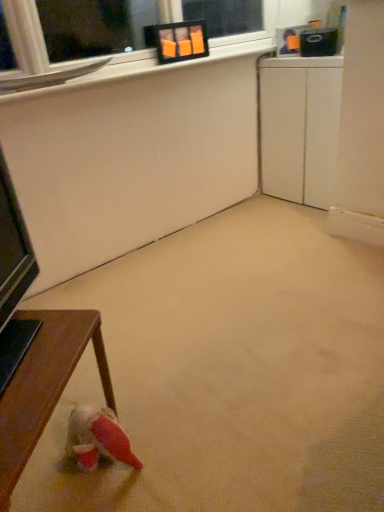
Question: Considering the relative sizes of wooden table at lower left and beige carpet at center in the image provided, is wooden table at lower left bigger than beige carpet at center?

Choices:
 (A) no
 (B) yes

Answer: (A)

Question: From a real-world perspective, does wooden table at lower left sit lower than beige carpet at center?

Choices:
 (A) yes
 (B) no

Answer: (B)

Question: Is wooden table at lower left not near beige carpet at center?

Choices:
 (A) no
 (B) yes

Answer: (A)

Question: Is beige carpet at center inside wooden table at lower left?

Choices:
 (A) no
 (B) yes

Answer: (A)

Question: Is wooden table at lower left thinner than beige carpet at center?

Choices:
 (A) yes
 (B) no

Answer: (A)

Question: Choose the correct answer: Is beige carpet at center inside white matte cabinet at right or outside it?

Choices:
 (A) outside
 (B) inside

Answer: (A)

Question: In terms of width, does beige carpet at center look wider or thinner when compared to white matte cabinet at right?

Choices:
 (A) thin
 (B) wide

Answer: (B)

Question: From a real-world perspective, is beige carpet at center positioned above or below white matte cabinet at right?

Choices:
 (A) below
 (B) above

Answer: (A)

Question: From the image's perspective, is beige carpet at center above or below white matte cabinet at right?

Choices:
 (A) below
 (B) above

Answer: (A)

Question: Considering the positions of point [x=319, y=190] and point [x=228, y=366], is point [x=319, y=190] closer or farther from the camera than point [x=228, y=366]?

Choices:
 (A) closer
 (B) farther

Answer: (B)

Question: In terms of height, does white matte cabinet at right look taller or shorter compared to beige carpet at center?

Choices:
 (A) short
 (B) tall

Answer: (B)

Question: Relative to beige carpet at center, is white matte cabinet at right in front or behind?

Choices:
 (A) front
 (B) behind

Answer: (B)

Question: In terms of size, does white matte cabinet at right appear bigger or smaller than beige carpet at center?

Choices:
 (A) big
 (B) small

Answer: (B)

Question: Does point (175, 348) appear closer or farther from the camera than point (34, 411)?

Choices:
 (A) farther
 (B) closer

Answer: (A)

Question: Would you say beige carpet at center is to the left or to the right of wooden table at lower left in the picture?

Choices:
 (A) right
 (B) left

Answer: (A)